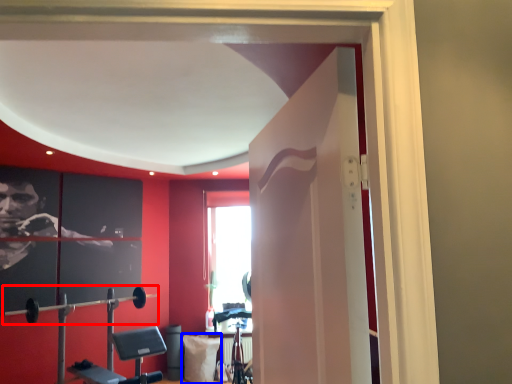
Question: Which point is closer to the camera, barbell (highlighted by a red box) or pillow (highlighted by a blue box)?

Choices:
 (A) barbell
 (B) pillow

Answer: (A)